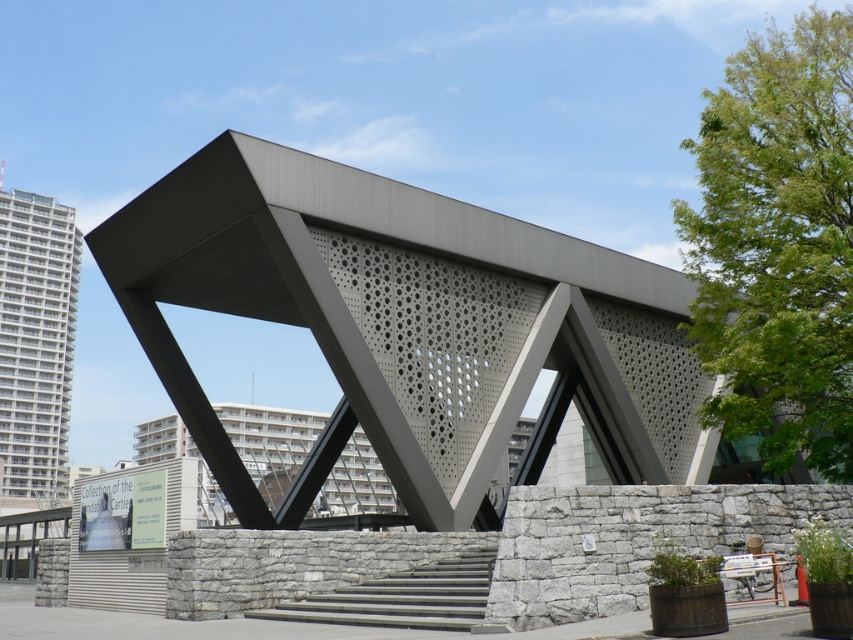
Who is shorter, white concrete building at left or gray concrete stairs at center?

Standing shorter between the two is gray concrete stairs at center.

The width and height of the screenshot is (853, 640). Describe the element at coordinates (36, 339) in the screenshot. I see `white concrete building at left` at that location.

Is point (54, 282) in front of point (439, 577)?

No, (54, 282) is behind (439, 577).

The width and height of the screenshot is (853, 640). Find the location of `white concrete building at left`. white concrete building at left is located at coordinates (36, 339).